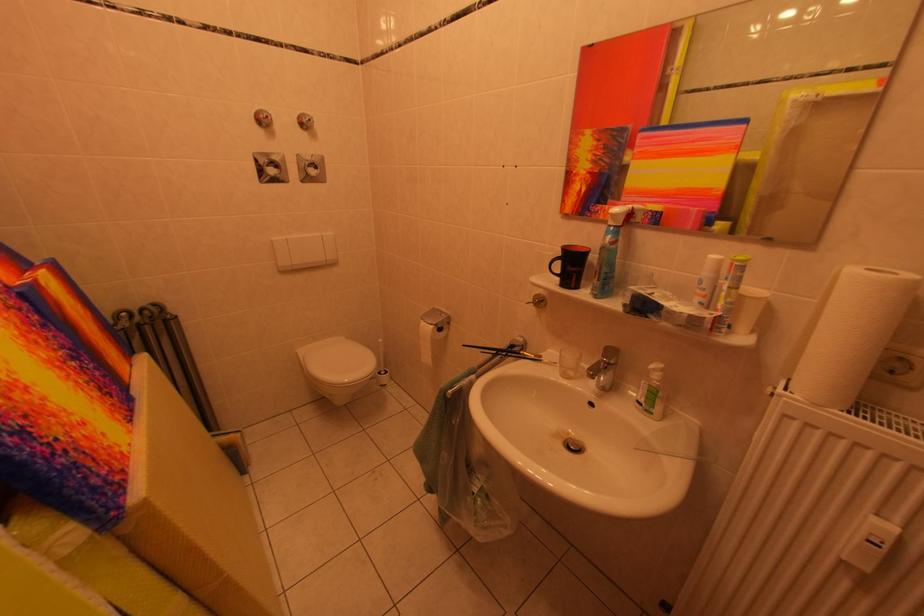
This screenshot has height=616, width=924. What do you see at coordinates (555, 265) in the screenshot? I see `the black mug handle` at bounding box center [555, 265].